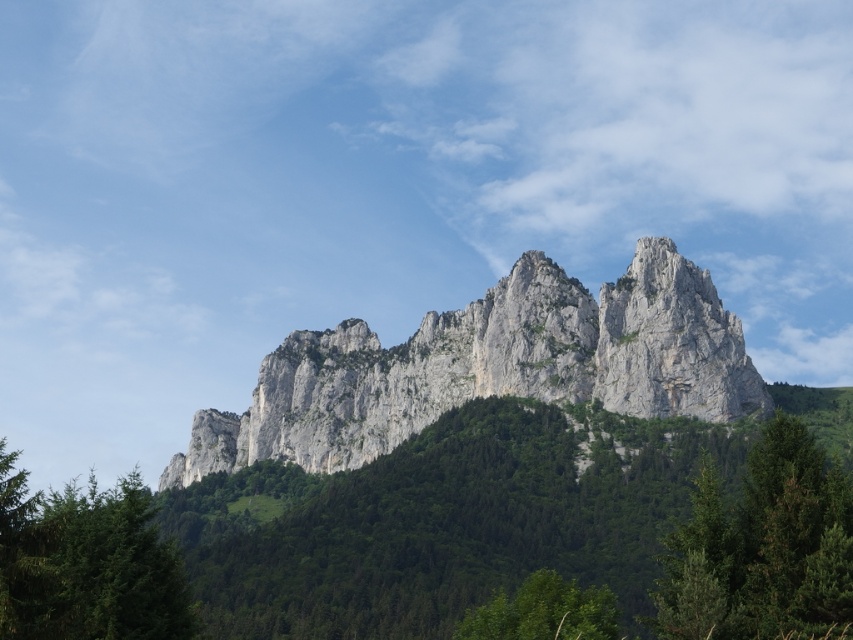
In the scene shown: Between rugged stone mountain at center and green matte tree at lower left, which one has more height?

With more height is rugged stone mountain at center.

Can you confirm if rugged stone mountain at center is smaller than green matte tree at lower left?

Indeed, rugged stone mountain at center has a smaller size compared to green matte tree at lower left.

Locate an element on the screen. The image size is (853, 640). rugged stone mountain at center is located at coordinates (491, 365).

In order to click on rugged stone mountain at center in this screenshot , I will do `click(491, 365)`.

Is green leafy tree at center in front of green leafy tree at lower center?

Yes, it is.

Find the location of a particular element. This screenshot has width=853, height=640. green leafy tree at center is located at coordinates (444, 522).

Does point (480, 465) lie behind point (480, 616)?

Yes, point (480, 465) is farther from viewer.

At what (x,y) coordinates should I click in order to perform the action: click on green leafy tree at center. Please return your answer as a coordinate pair (x, y). Image resolution: width=853 pixels, height=640 pixels. Looking at the image, I should click on (444, 522).

Based on the photo, is green matte tree at lower left in front of green leafy tree at lower center?

Yes, green matte tree at lower left is closer to the viewer.

Is green matte tree at lower left positioned behind green leafy tree at lower center?

No, it is not.

Is point (114, 525) positioned before point (590, 586)?

That is True.

The height and width of the screenshot is (640, 853). What are the coordinates of `green matte tree at lower left` in the screenshot? It's located at (86, 563).